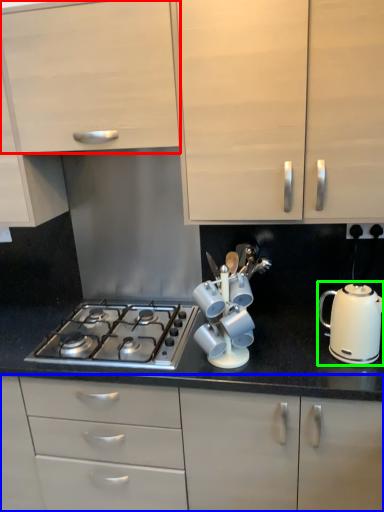
Question: Based on their relative distances, which object is farther from cabinetry (highlighted by a red box)? Choose from cabinetry (highlighted by a blue box) and kitchen appliance (highlighted by a green box).

Choices:
 (A) cabinetry
 (B) kitchen appliance

Answer: (A)